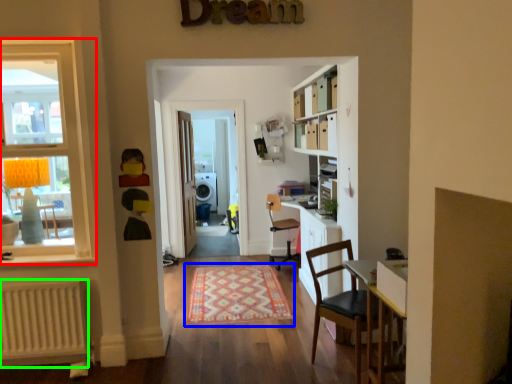
Question: Considering the real-world distances, which object is farthest from window (highlighted by a red box)? mat (highlighted by a blue box) or radiator (highlighted by a green box)?

Choices:
 (A) mat
 (B) radiator

Answer: (A)